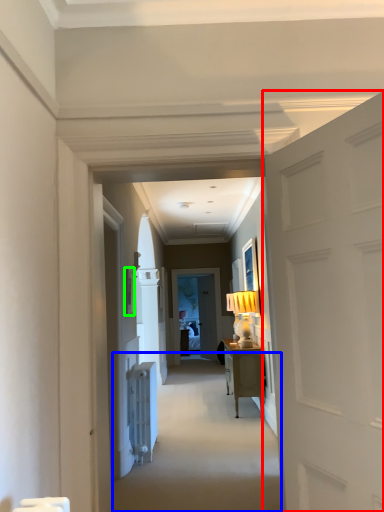
Question: Estimate the real-world distances between objects in this image. Which object is closer to door (highlighted by a red box), path (highlighted by a blue box) or picture frame (highlighted by a green box)?

Choices:
 (A) path
 (B) picture frame

Answer: (A)